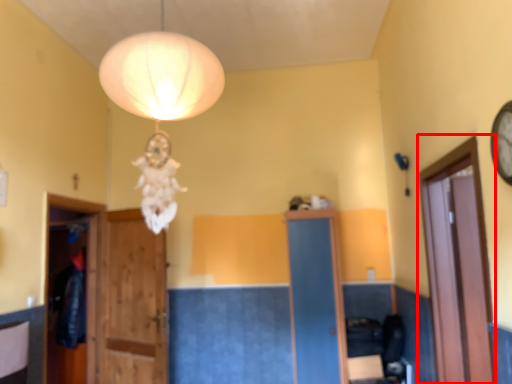
Question: From the image's perspective, considering the relative positions of glass door (annotated by the red box) and door in the image provided, where is glass door (annotated by the red box) located with respect to the staircase?

Choices:
 (A) below
 (B) above

Answer: (B)